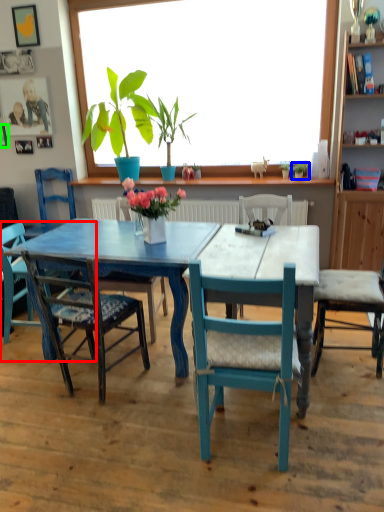
Question: Which is nearer to the chair (highlighted by a red box)? houseplant (highlighted by a blue box) or picture frame (highlighted by a green box).

Choices:
 (A) houseplant
 (B) picture frame

Answer: (B)